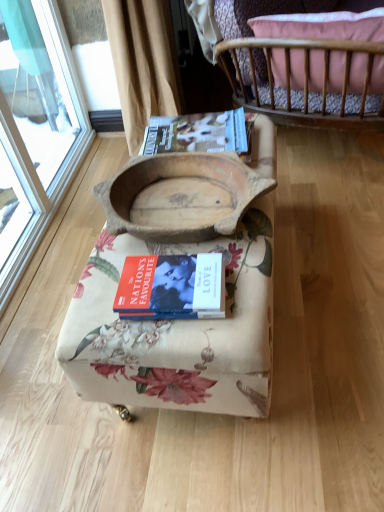
Question: Looking at the image, does wooden crib at upper right, acting as the second furniture starting from the bottom, seem bigger or smaller compared to hardcover book at center?

Choices:
 (A) small
 (B) big

Answer: (B)

Question: From the image's perspective, is wooden crib at upper right, acting as the second furniture starting from the bottom, located above or below hardcover book at center?

Choices:
 (A) above
 (B) below

Answer: (A)

Question: Based on their relative distances, which object is farther from the wooden bowl at center?

Choices:
 (A) hardcover book at center
 (B) wooden bowl at center, acting as the 1th furniture starting from the bottom
 (C) hardcover magazine at upper center
 (D) wooden crib at upper right, acting as the second furniture starting from the bottom

Answer: (D)

Question: Which of these objects is positioned closest to the wooden crib at upper right, which is the 1th furniture from top to bottom?

Choices:
 (A) wooden bowl at center
 (B) hardcover magazine at upper center
 (C) wooden bowl at center, acting as the 1th furniture starting from the bottom
 (D) hardcover book at center

Answer: (B)